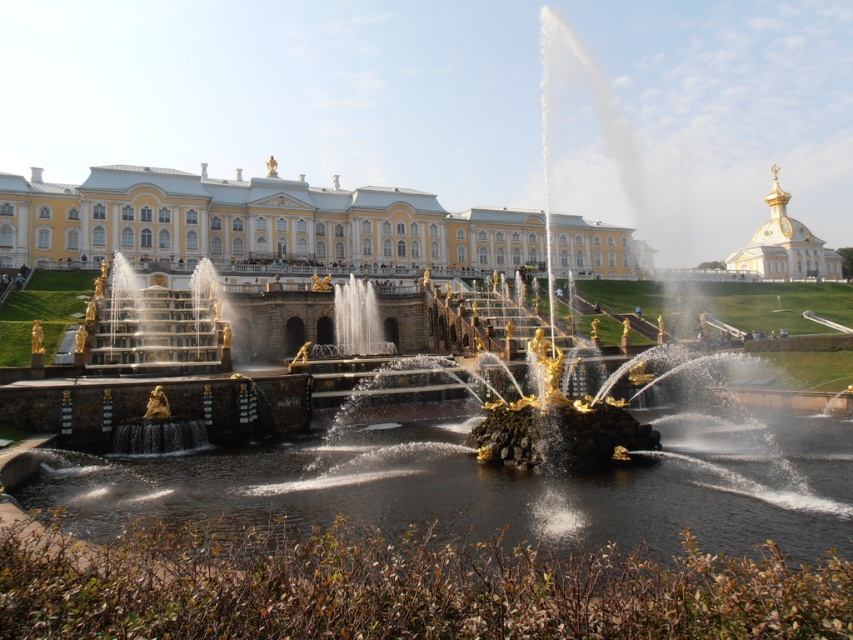
Measure the distance between point (779, 512) and camera.

They are 148.77 feet apart.

Between clear water at fountain center and yellow/white marble palace at center, which one appears on the right side from the viewer's perspective?

clear water at fountain center is more to the right.

Find the location of a particular element. clear water at fountain center is located at coordinates (492, 486).

Is clear water at fountain center shorter than gold plated dome at upper right?

Yes, clear water at fountain center is shorter than gold plated dome at upper right.

Is clear water at fountain center wider than gold plated dome at upper right?

Yes, clear water at fountain center is wider than gold plated dome at upper right.

This screenshot has width=853, height=640. Find the location of `clear water at fountain center`. clear water at fountain center is located at coordinates (492, 486).

At what (x,y) coordinates should I click in order to perform the action: click on yellow/white marble palace at center. Please return your answer as a coordinate pair (x, y). Looking at the image, I should click on (253, 221).

Is yellow/white marble palace at center below gold plated dome at upper right?

Yes, yellow/white marble palace at center is below gold plated dome at upper right.

Identify the location of yellow/white marble palace at center. The height and width of the screenshot is (640, 853). (x=253, y=221).